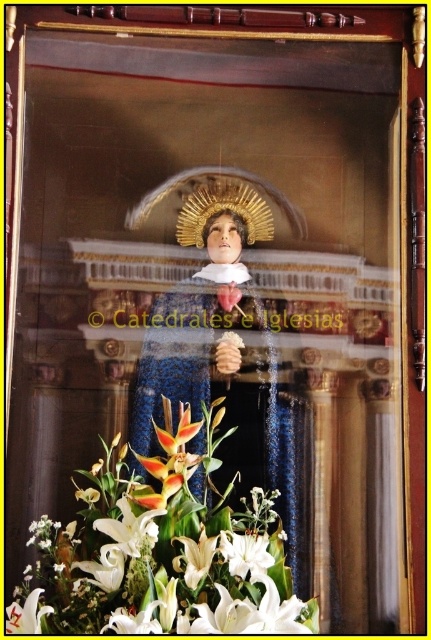
Question: Estimate the real-world distances between objects in this image. Which object is farther from the white lily at lower center?

Choices:
 (A) white lily at lower left
 (B) white lilies at lower center

Answer: (A)

Question: Can you confirm if white lilies at lower center is positioned to the left of white lily at lower left?

Choices:
 (A) no
 (B) yes

Answer: (A)

Question: Which point is closer to the camera taking this photo?

Choices:
 (A) pyautogui.click(x=40, y=588)
 (B) pyautogui.click(x=109, y=467)

Answer: (A)

Question: Which is farther from the white lily at lower center?

Choices:
 (A) white lilies at lower center
 (B) white lily at lower left

Answer: (B)

Question: From the image, what is the correct spatial relationship of white lilies at lower center in relation to white lily at lower left?

Choices:
 (A) right
 (B) left

Answer: (A)

Question: Can you confirm if white lily at lower center is positioned above white lily at lower left?

Choices:
 (A) yes
 (B) no

Answer: (A)